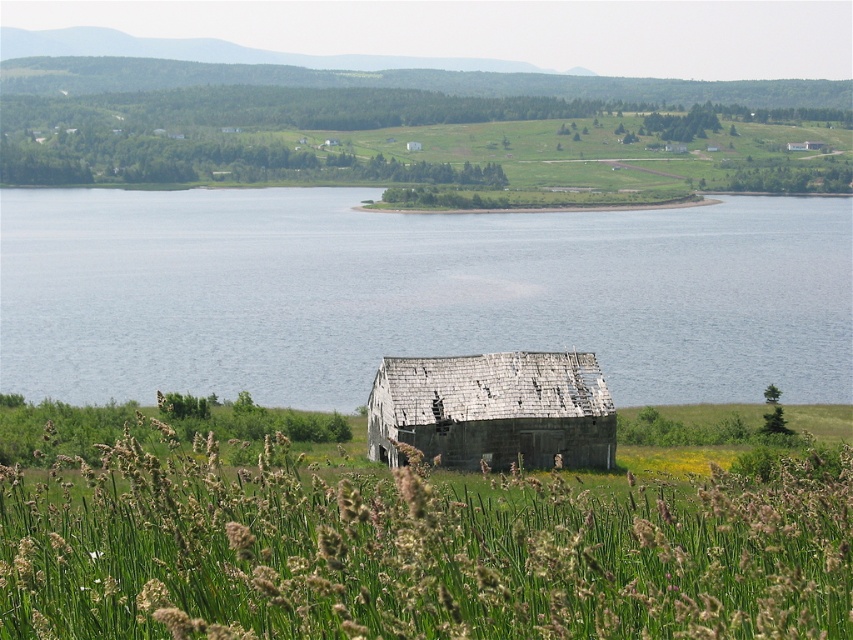
Question: Which of the following is the farthest from the observer?

Choices:
 (A) green grassy at center
 (B) blue water at center

Answer: (B)

Question: Is blue water at center below weathered wood hut at center?

Choices:
 (A) no
 (B) yes

Answer: (A)

Question: Which point is closer to the camera taking this photo?

Choices:
 (A) pos(206,522)
 (B) pos(534,449)
 (C) pos(738,214)

Answer: (A)

Question: Is green grassy at center positioned before weathered wood hut at center?

Choices:
 (A) no
 (B) yes

Answer: (B)

Question: Can you confirm if blue water at center is bigger than weathered wood hut at center?

Choices:
 (A) no
 (B) yes

Answer: (B)

Question: Which object is farther from the camera taking this photo?

Choices:
 (A) green grassy at center
 (B) blue water at center

Answer: (B)